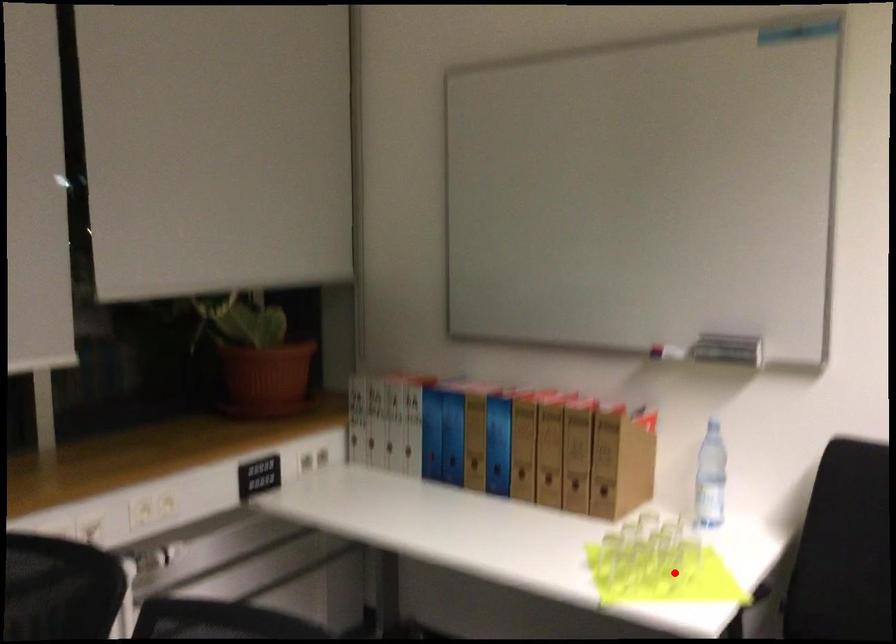
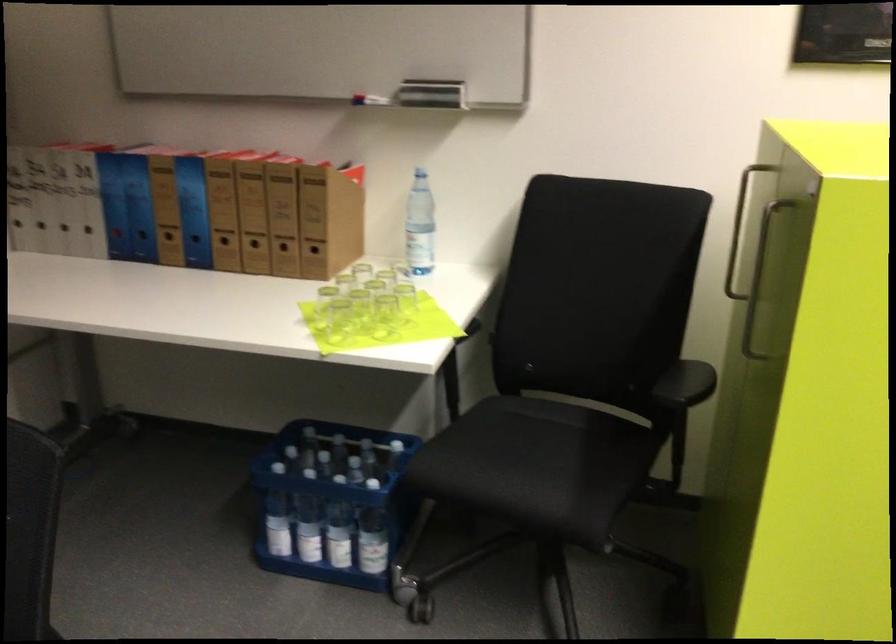
Where in the second image is the point corresponding to the highlighted location from the first image?

(383, 316)